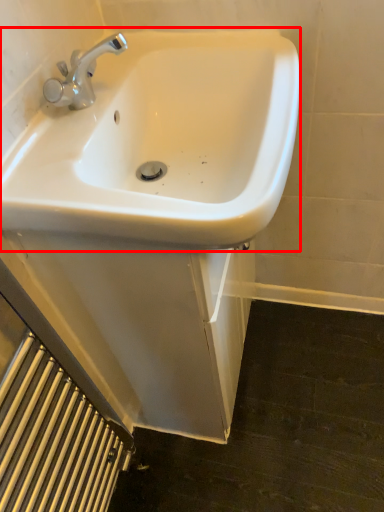
Question: From the image's perspective, where is sink (annotated by the red box) located relative to radiator?

Choices:
 (A) above
 (B) below

Answer: (A)